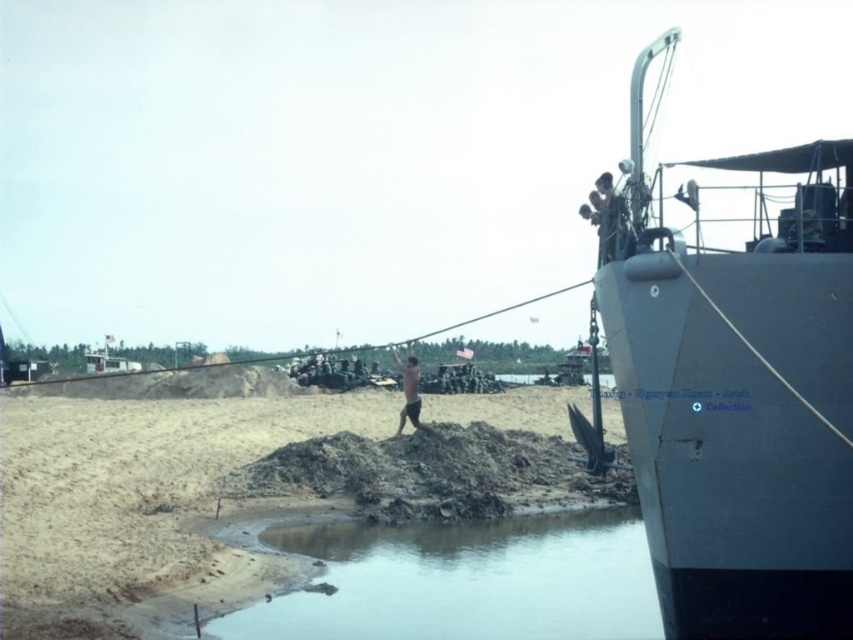
Question: Does dark gray metal boat at upper right appear under brown sandy dirt at center?

Choices:
 (A) yes
 (B) no

Answer: (B)

Question: Which of the following is the farthest from the observer?

Choices:
 (A) smooth skin person at upper right
 (B) skinny man at center

Answer: (B)

Question: Does dark gray metal boat at upper right have a lesser width compared to smooth skin person at upper right?

Choices:
 (A) yes
 (B) no

Answer: (B)

Question: Which point is farther from the camera taking this photo?

Choices:
 (A) (612, 228)
 (B) (762, 611)
 (C) (426, 616)

Answer: (C)

Question: Can you confirm if smooth skin person at upper right is smaller than skinny man at center?

Choices:
 (A) yes
 (B) no

Answer: (B)

Question: Among these objects, which one is farthest from the camera?

Choices:
 (A) brown sandy dirt at center
 (B) dark gray metal boat at upper right

Answer: (A)